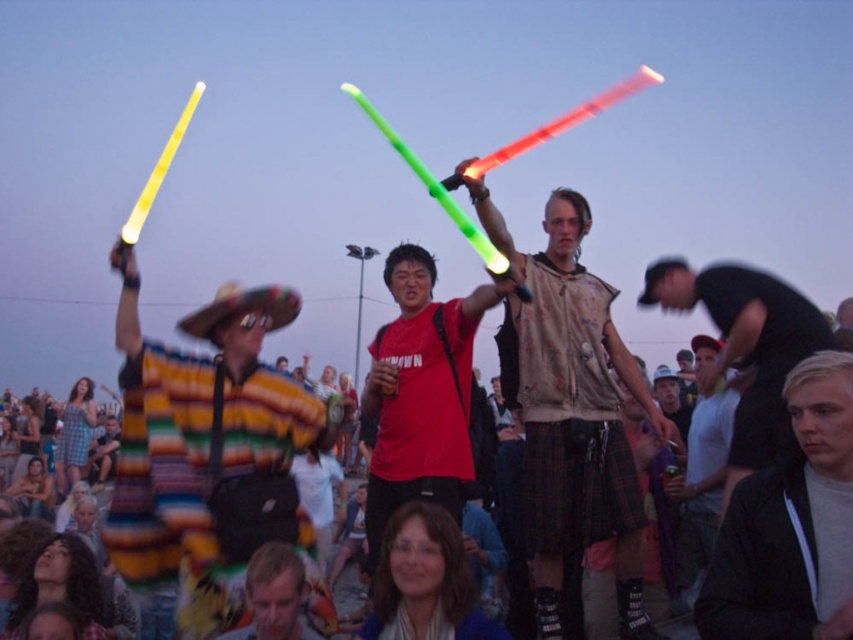
You are a photographer trying to capture a photo of both the matte brown vest at center and the black matte shirt at right. Which one should you focus on first to ensure both are in focus?

You should focus on the matte brown vest at center first because it is closer to you than the black matte shirt at right, so focusing on the closer object will help ensure both are in focus.